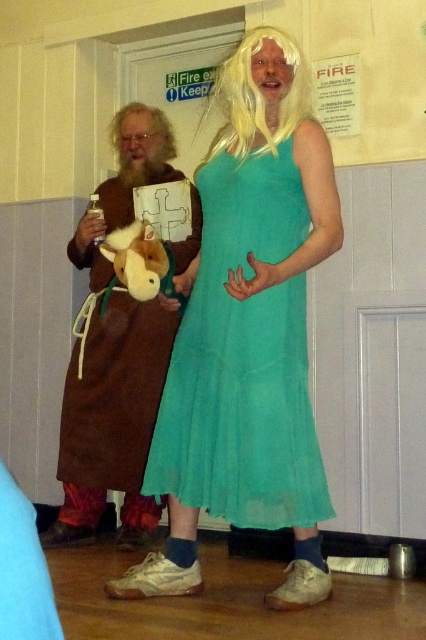
Question: Which of the following is the closest to the observer?

Choices:
 (A) (290, 220)
 (B) (164, 141)
 (C) (48, 540)
 (D) (132, 241)

Answer: (A)

Question: Which object is closer to the camera taking this photo?

Choices:
 (A) brown plush toy at left
 (B) blonde synthetic wig at center
 (C) brown leather robe at left
 (D) blonde synthetic wig at upper left

Answer: (B)

Question: Does brown leather robe at left have a smaller size compared to blonde synthetic wig at center?

Choices:
 (A) yes
 (B) no

Answer: (B)

Question: Is teal chiffon dress at center wider than blonde synthetic wig at upper left?

Choices:
 (A) no
 (B) yes

Answer: (B)

Question: Which of the following is the closest to the observer?

Choices:
 (A) teal chiffon dress at center
 (B) brown leather robe at left

Answer: (A)

Question: Does blonde synthetic wig at center have a smaller size compared to blonde synthetic wig at upper left?

Choices:
 (A) no
 (B) yes

Answer: (B)